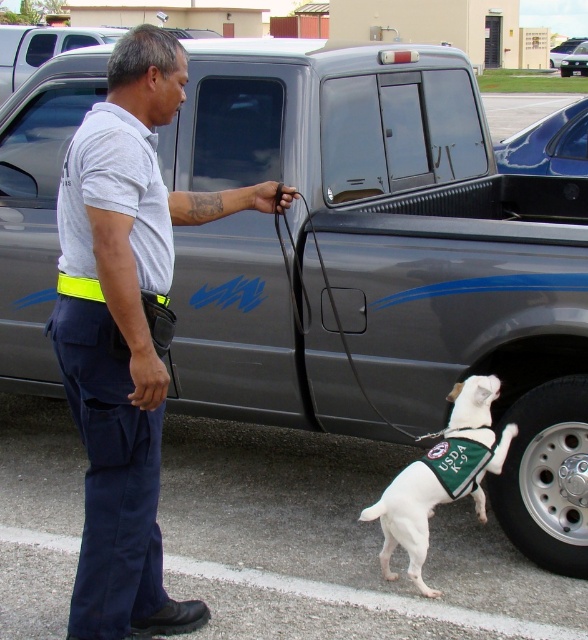
Question: Observing the image, what is the correct spatial positioning of white fabric vest at lower right in reference to black rubber leash at center?

Choices:
 (A) below
 (B) above

Answer: (A)

Question: Which point is farther to the camera?

Choices:
 (A) (539, 412)
 (B) (348, 356)

Answer: (B)

Question: Is gray cotton shirt at center positioned at the back of silver metallic tire at lower right?

Choices:
 (A) no
 (B) yes

Answer: (A)

Question: Which point is closer to the camera?

Choices:
 (A) (423, 506)
 (B) (156, 412)
 (C) (505, 461)
 (D) (373, 404)

Answer: (B)

Question: Estimate the real-world distances between objects in this image. Which object is closer to the silver metallic tire at lower right?

Choices:
 (A) black rubber leash at center
 (B) white fabric vest at lower right
 (C) gray cotton shirt at center

Answer: (B)

Question: Can you confirm if white fabric vest at lower right is positioned above black rubber leash at center?

Choices:
 (A) yes
 (B) no

Answer: (B)